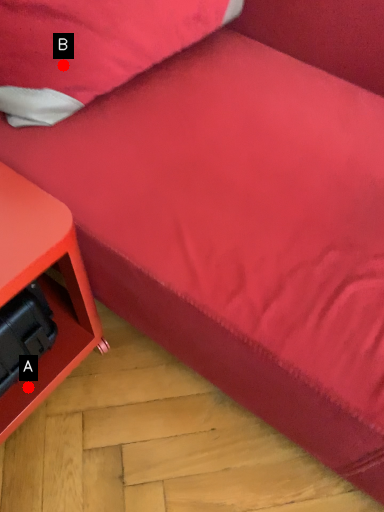
Question: Two points are circled on the image, labeled by A and B beside each circle. Which point appears closest to the camera in this image?

Choices:
 (A) A is closer
 (B) B is closer

Answer: (B)